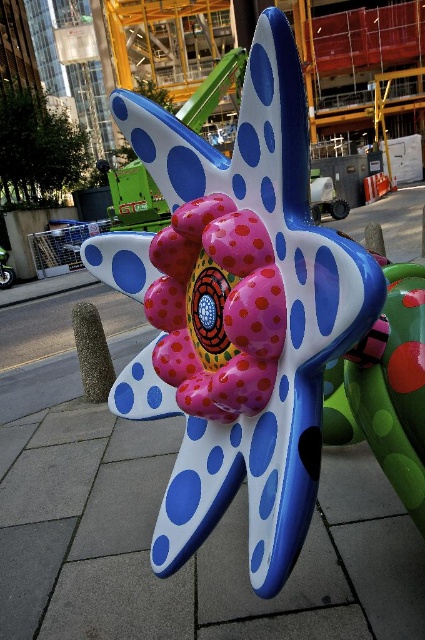
Is glossy plastic starfish at center smaller than pink glossy flower at center?

Actually, glossy plastic starfish at center might be larger than pink glossy flower at center.

Does glossy plastic starfish at center have a lesser height compared to pink glossy flower at center?

Incorrect, glossy plastic starfish at center's height does not fall short of pink glossy flower at center's.

Between point (277, 486) and point (153, 314), which one is positioned behind?

Point (153, 314)

Find the location of a particular element. The image size is (425, 640). glossy plastic starfish at center is located at coordinates (237, 312).